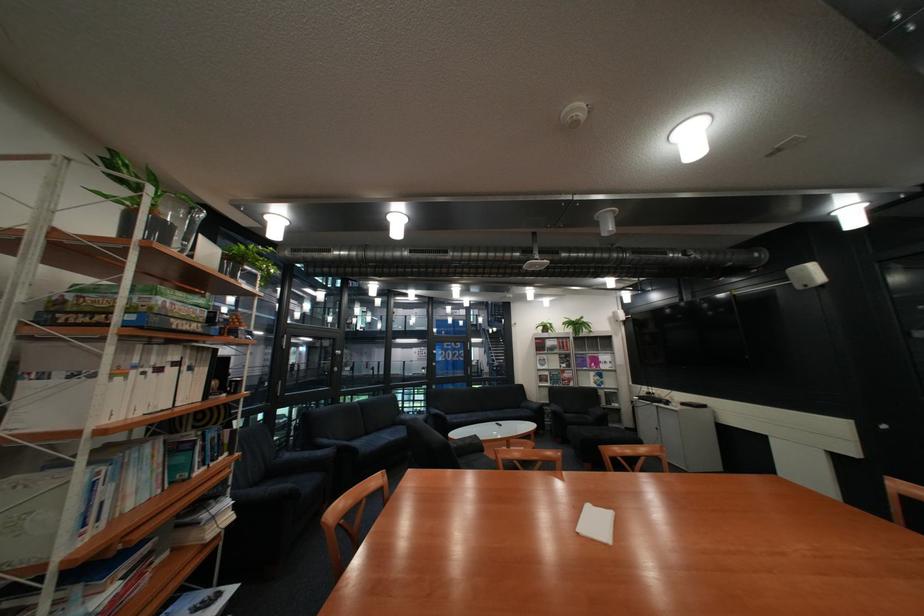
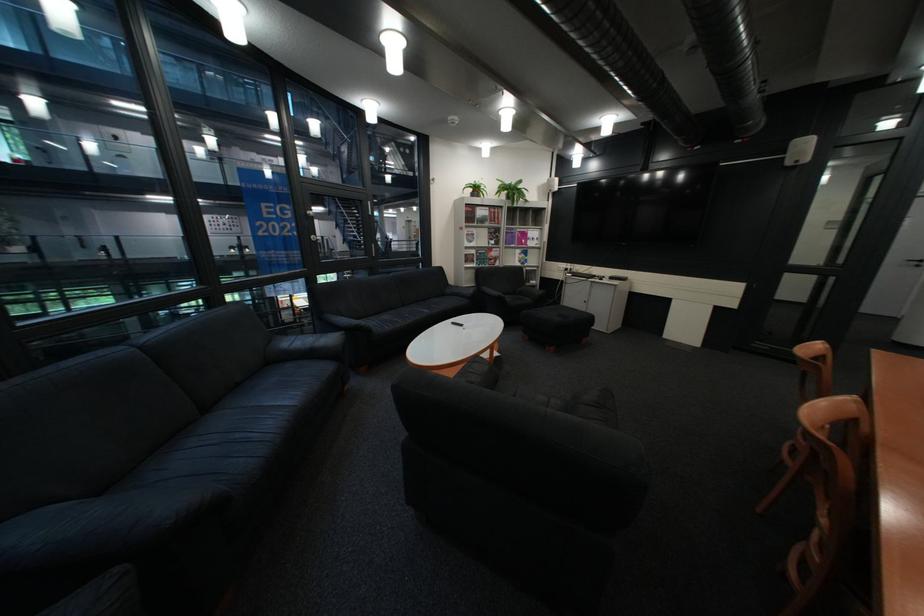
In the second image, find the point that corresponds to point 564,355 in the first image.

(492, 229)